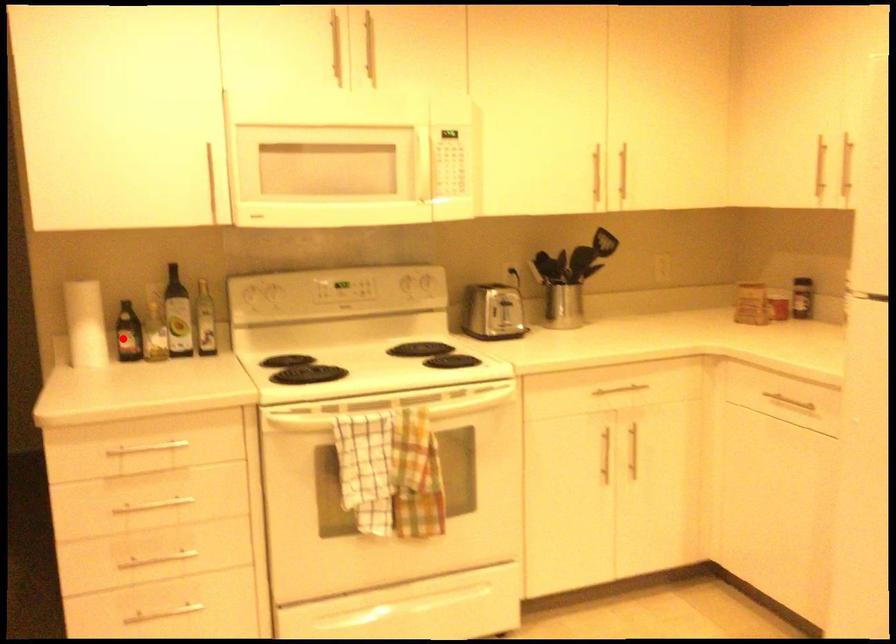
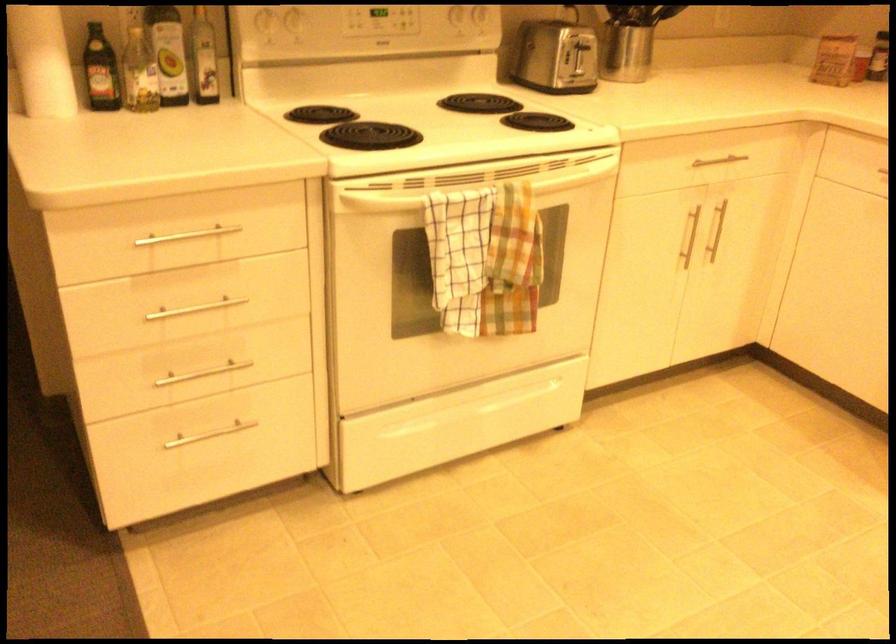
In the second image, find the point that corresponds to the highlighted location in the first image.

(100, 71)